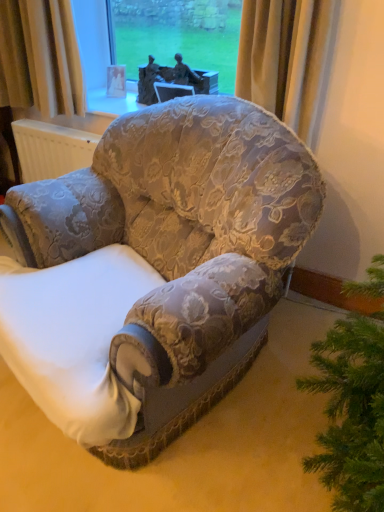
Question: Based on their sizes in the image, would you say bronze statue at upper center is bigger or smaller than floral fabric armchair at center?

Choices:
 (A) small
 (B) big

Answer: (A)

Question: Which is correct: bronze statue at upper center is inside floral fabric armchair at center, or outside of it?

Choices:
 (A) inside
 (B) outside

Answer: (B)

Question: From a real-world perspective, is bronze statue at upper center above or below floral fabric armchair at center?

Choices:
 (A) above
 (B) below

Answer: (A)

Question: From the image's perspective, is floral fabric armchair at center positioned above or below bronze statue at upper center?

Choices:
 (A) below
 (B) above

Answer: (A)

Question: Is floral fabric armchair at center bigger or smaller than bronze statue at upper center?

Choices:
 (A) big
 (B) small

Answer: (A)

Question: From a real-world perspective, is floral fabric armchair at center above or below bronze statue at upper center?

Choices:
 (A) above
 (B) below

Answer: (B)

Question: Is floral fabric armchair at center taller or shorter than bronze statue at upper center?

Choices:
 (A) tall
 (B) short

Answer: (A)